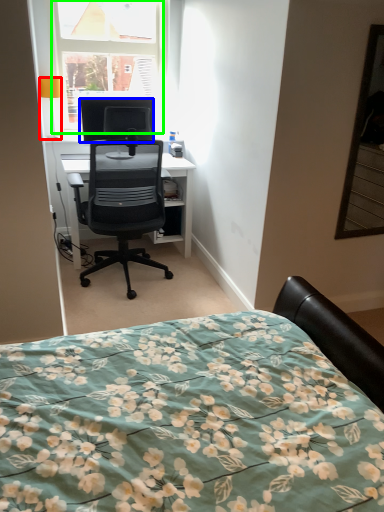
Question: Which is nearer to the lamp (highlighted by a red box)? television (highlighted by a blue box) or window (highlighted by a green box).

Choices:
 (A) television
 (B) window

Answer: (A)